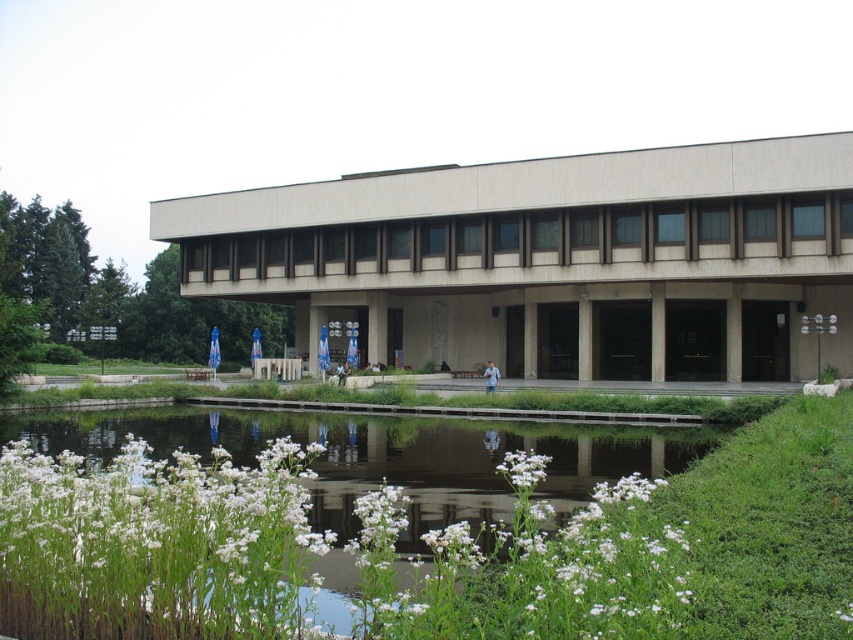
This screenshot has height=640, width=853. Identify the location of beige concrete building at center. (553, 259).